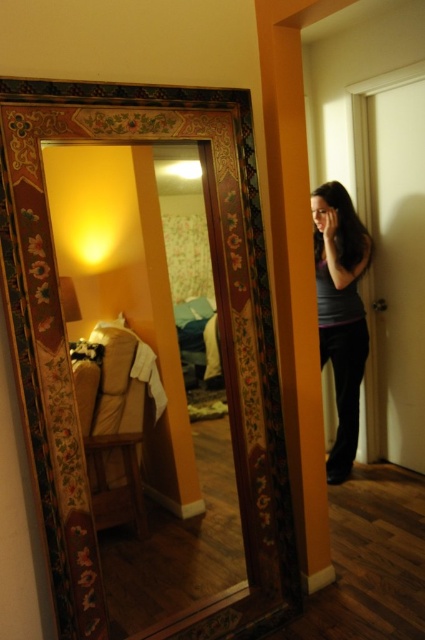
Question: Does wooden mirror at center come in front of matte gray shirt at right?

Choices:
 (A) yes
 (B) no

Answer: (A)

Question: Which point is farther to the camera?

Choices:
 (A) (354, 269)
 (B) (90, 368)

Answer: (A)

Question: In this image, where is wooden mirror at center located relative to matte gray shirt at right?

Choices:
 (A) above
 (B) below

Answer: (B)

Question: Which object is closer to the camera taking this photo?

Choices:
 (A) wooden mirror at center
 (B) matte gray shirt at right

Answer: (A)

Question: Where is wooden mirror at center located in relation to matte gray shirt at right in the image?

Choices:
 (A) above
 (B) below

Answer: (B)